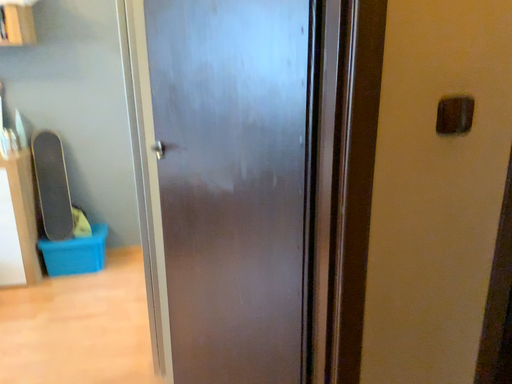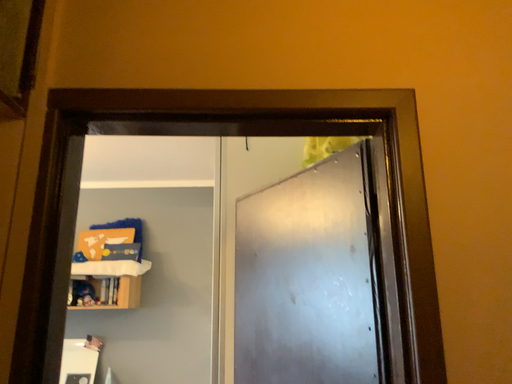
Question: Which way did the camera rotate in the video?

Choices:
 (A) rotated downward
 (B) rotated upward

Answer: (B)